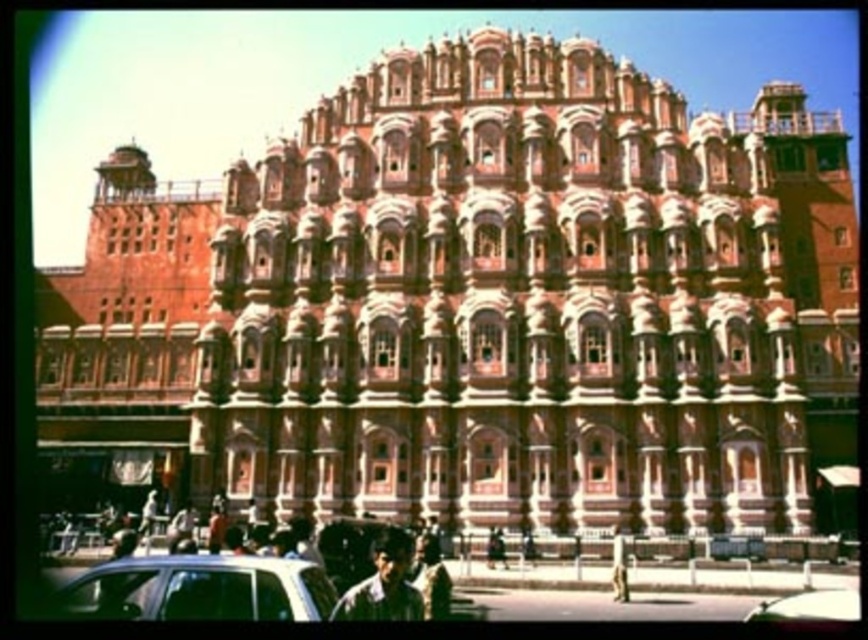
You are a photographer planning to capture the Hawa Mahal in a photo. You want to ensure that both the white glossy car at lower left and the metallic silver car at lower center are visible in the frame. Considering their heights, which car might block the view of the Hawa Mahel if positioned closer to the camera?

The white glossy car at lower left is much taller than the metallic silver car at lower center. Therefore, the white glossy car at lower left is more likely to block the view of the Hawa Mahel if it is positioned closer to the camera.

You are a tourist visiting Hawa Mahal and see two cars in the foreground. The white glossy car at lower left and the metallic silver car at lower center. Which car is positioned higher relative to the other?

The white glossy car at lower left is positioned above the metallic silver car at lower center.

You are a tour guide leading a group near the Hawa Mahal. You notice a white glossy car at lower left and a metallic silver car at lower center. Your group wants to take a photo that includes both cars and the Hawa Mahal in the background. Can you position the group at a spot where all three elements are visible? Explain your reasoning.

The white glossy car at lower left is 86.21 feet away from the metallic silver car at lower center. Since the distance between them is significant, positioning the group between the two cars while facing the Hawa Mahal would allow all three elements to be captured in the photo.